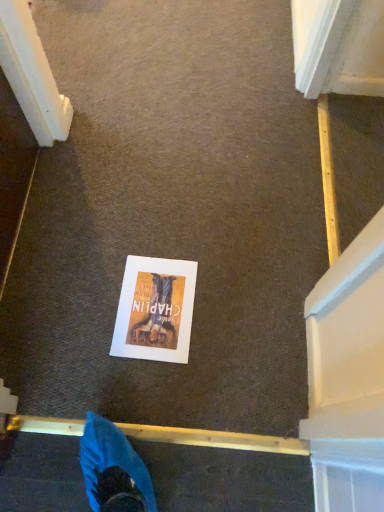
The image size is (384, 512). I want to click on vacant space in front of white paper at center, so click(148, 390).